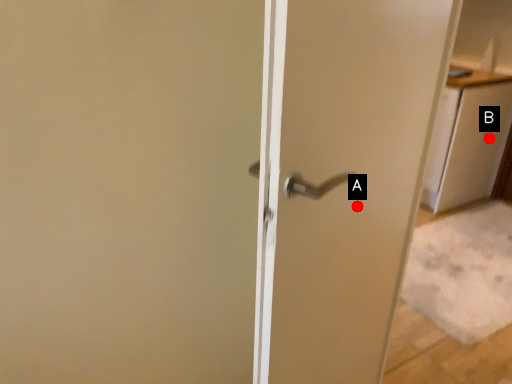
Question: Two points are circled on the image, labeled by A and B beside each circle. Which point is further to the camera?

Choices:
 (A) A is further
 (B) B is further

Answer: (B)